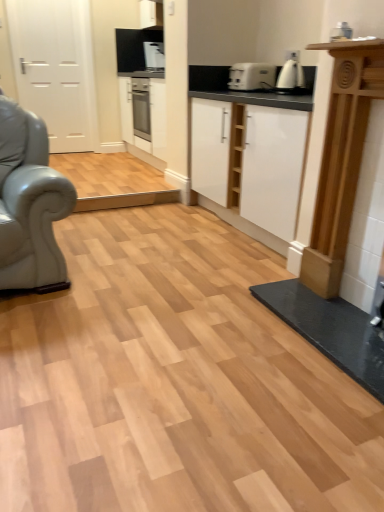
Question: Considering the positions of white glossy kettle at upper right, placed as the first coffee machine when sorted from right to left, and white matte cabinet at center in the image, is white glossy kettle at upper right, placed as the first coffee machine when sorted from right to left, taller or shorter than white matte cabinet at center?

Choices:
 (A) short
 (B) tall

Answer: (A)

Question: Looking at the image, does white glossy kettle at upper right, the first coffee machine from the bottom, seem bigger or smaller compared to white matte cabinet at center?

Choices:
 (A) big
 (B) small

Answer: (B)

Question: Which is farther from the satin silver coffee machine at upper center, the 1th coffee machine from the back?

Choices:
 (A) white matte door at left
 (B) white plastic toaster at center
 (C) white matte cabinet at center
 (D) white glossy kettle at upper right, placed as the first coffee machine when sorted from right to left

Answer: (D)

Question: Estimate the real-world distances between objects in this image. Which object is closer to the white glossy kettle at upper right, the second coffee machine when ordered from back to front?

Choices:
 (A) white matte door at left
 (B) satin silver coffee machine at upper center, arranged as the 1th coffee machine when viewed from the top
 (C) white plastic toaster at center
 (D) white matte cabinet at center

Answer: (C)